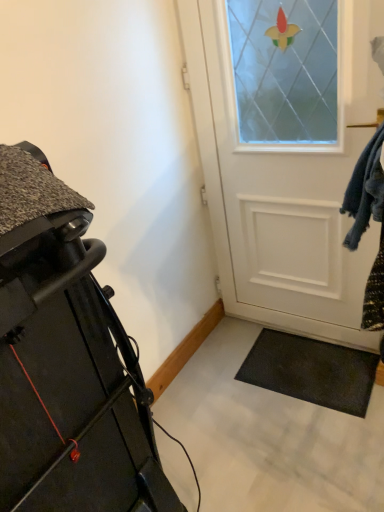
This screenshot has height=512, width=384. What do you see at coordinates (66, 360) in the screenshot?
I see `matte black treadmill at left` at bounding box center [66, 360].

You are a GUI agent. You are given a task and a screenshot of the screen. Output one action in this format:
    pyautogui.click(x=<x>, y=<y>)
    Task: Click on the matte black treadmill at left
    This screenshot has width=384, height=512.
    Given the screenshot: What is the action you would take?
    pyautogui.click(x=66, y=360)

At what (x,y) coordinates should I click in order to perform the action: click on white matte door at center. Please return your answer as a coordinate pair (x, y). This screenshot has width=384, height=512. Looking at the image, I should click on (278, 205).

Image resolution: width=384 pixels, height=512 pixels. What do you see at coordinates (278, 205) in the screenshot? I see `white matte door at center` at bounding box center [278, 205].

What is the approximate width of white matte door at center?

white matte door at center is 2.62 inches wide.

Locate an element on the screen. Image resolution: width=384 pixels, height=512 pixels. matte black treadmill at left is located at coordinates (66, 360).

Is matte black treadmill at left to the left or to the right of white matte door at center in the image?

Clearly, matte black treadmill at left is on the left of white matte door at center in the image.

Relative to white matte door at center, is matte black treadmill at left in front or behind?

matte black treadmill at left is in front of white matte door at center.

Is point (181, 505) less distant than point (293, 297)?

Yes, point (181, 505) is in front of point (293, 297).

From the image's perspective, between matte black treadmill at left and white matte door at center, which one is located above?

white matte door at center, from the image's perspective.

From a real-world perspective, which object rests below the other?

matte black treadmill at left is physically lower.

In the scene shown: Considering the relative sizes of matte black treadmill at left and white matte door at center in the image provided, is matte black treadmill at left wider than white matte door at center?

Yes, matte black treadmill at left is wider than white matte door at center.

From their relative heights in the image, would you say matte black treadmill at left is taller or shorter than white matte door at center?

Clearly, matte black treadmill at left is shorter compared to white matte door at center.

Who is bigger, matte black treadmill at left or white matte door at center?

matte black treadmill at left is bigger.

Is matte black treadmill at left completely or partially outside of white matte door at center?

Yes, matte black treadmill at left is outside of white matte door at center.

Is matte black treadmill at left beside white matte door at center?

No.

Is matte black treadmill at left looking in the opposite direction of white matte door at center?

No.

This screenshot has width=384, height=512. Find the location of `furniture to the left of white matte door at center`. furniture to the left of white matte door at center is located at coordinates (66, 360).

Is white matte door at center to the left of matte black treadmill at left from the viewer's perspective?

In fact, white matte door at center is to the right of matte black treadmill at left.

Between white matte door at center and matte black treadmill at left, which one is positioned in front?

matte black treadmill at left is closer to the camera.

Is point (286, 306) in front of point (86, 321)?

No, (286, 306) is behind (86, 321).

From the image's perspective, is white matte door at center beneath matte black treadmill at left?

Actually, white matte door at center appears above matte black treadmill at left in the image.

From a real-world perspective, is white matte door at center above or below matte black treadmill at left?

white matte door at center is above matte black treadmill at left.

Does white matte door at center have a lesser width compared to matte black treadmill at left?

Indeed, white matte door at center has a lesser width compared to matte black treadmill at left.

Between white matte door at center and matte black treadmill at left, which one has more height?

white matte door at center is taller.

Considering the sizes of white matte door at center and matte black treadmill at left in the image, is white matte door at center bigger or smaller than matte black treadmill at left?

Clearly, white matte door at center is smaller in size than matte black treadmill at left.

Is white matte door at center not inside matte black treadmill at left?

white matte door at center lies outside matte black treadmill at left's area.

Is white matte door at center next to matte black treadmill at left?

No, white matte door at center is not making contact with matte black treadmill at left.

Could you tell me if white matte door at center is turned towards matte black treadmill at left?

Yes, white matte door at center faces towards matte black treadmill at left.

Locate an element on the screen. Image resolution: width=384 pixels, height=512 pixels. furniture that appears in front of the white matte door at center is located at coordinates (66, 360).

You are a GUI agent. You are given a task and a screenshot of the screen. Output one action in this format:
    pyautogui.click(x=<x>, y=<y>)
    Task: Click on the door behind the matte black treadmill at left
    
    Given the screenshot: What is the action you would take?
    pyautogui.click(x=278, y=205)

Identify the location of furniture in front of the white matte door at center. click(x=66, y=360).